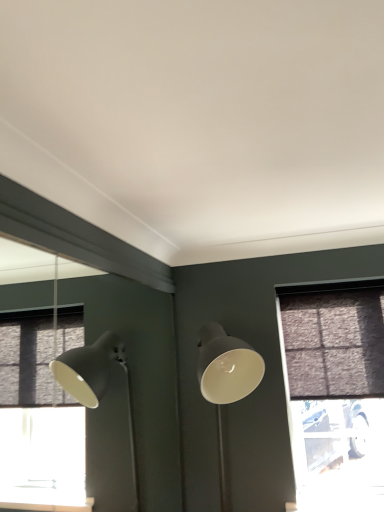
Question: In the image, is matte gray lamp at center positioned in front of or behind brown textured curtain at right?

Choices:
 (A) front
 (B) behind

Answer: (A)

Question: From their relative heights in the image, would you say matte gray lamp at center is taller or shorter than brown textured curtain at right?

Choices:
 (A) short
 (B) tall

Answer: (B)

Question: Which is nearer to the matte gray lamp at center?

Choices:
 (A) brown textured curtain at right
 (B) textured dark gray window at right

Answer: (A)

Question: Which object is the closest to the matte gray lamp at center?

Choices:
 (A) brown textured curtain at right
 (B) textured dark gray window at right

Answer: (A)